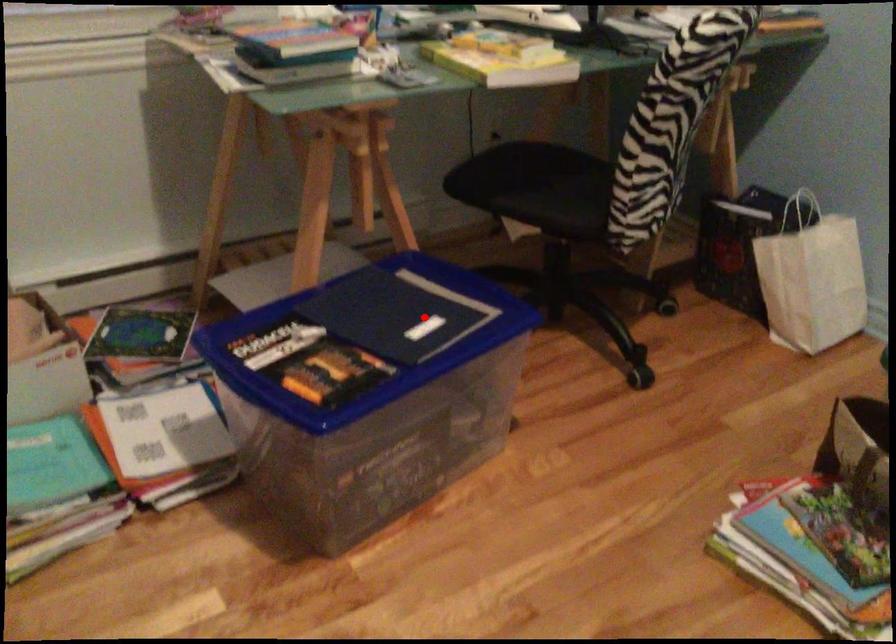
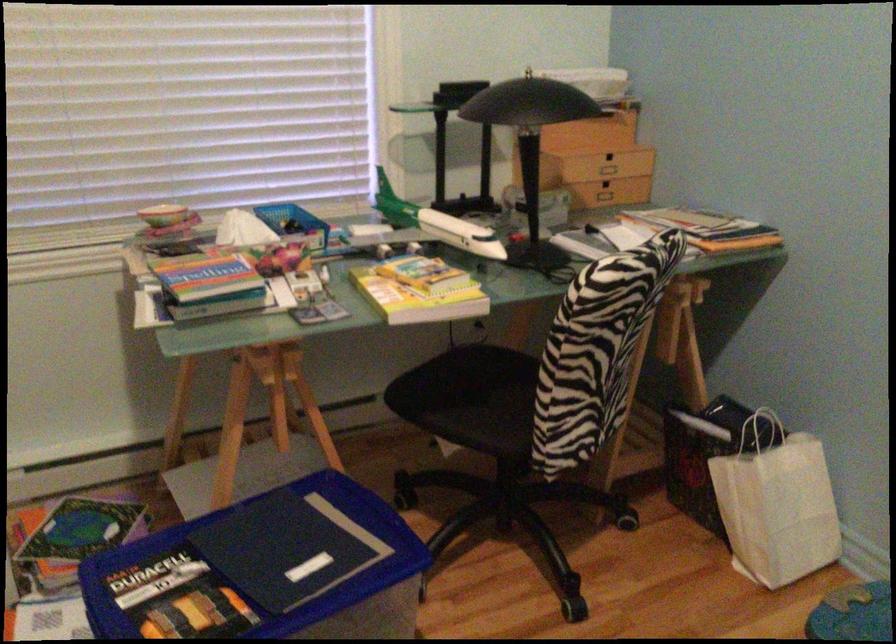
In the second image, find the point that corresponds to the highlighted location in the first image.

(316, 551)